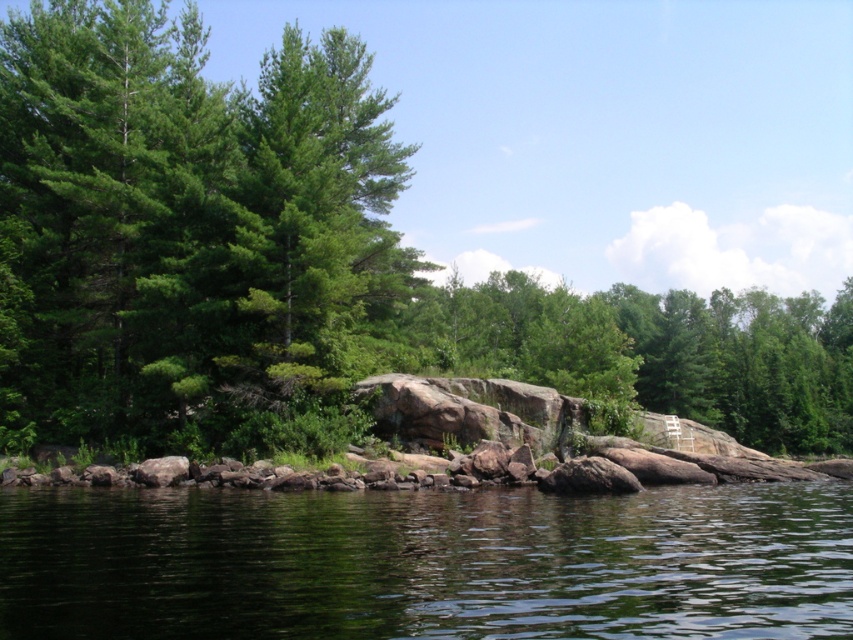
Does green matte tree at left appear on the left side of green matte tree at center?

Correct, you'll find green matte tree at left to the left of green matte tree at center.

Is point (134, 342) farther from viewer compared to point (619, 330)?

That is False.

Does point (117, 269) come farther from viewer compared to point (471, 344)?

No.

Locate an element on the screen. This screenshot has height=640, width=853. green matte tree at left is located at coordinates (189, 234).

Can you confirm if green matte tree at left is thinner than transparent water at lower center?

Incorrect, green matte tree at left's width is not less than transparent water at lower center's.

Between green matte tree at left and transparent water at lower center, which one appears on the right side from the viewer's perspective?

transparent water at lower center

The width and height of the screenshot is (853, 640). What do you see at coordinates (189, 234) in the screenshot?
I see `green matte tree at left` at bounding box center [189, 234].

Where is `green matte tree at left`? green matte tree at left is located at coordinates (189, 234).

Does transparent water at lower center have a greater width compared to green matte tree at center?

No.

Who is taller, transparent water at lower center or green matte tree at center?

green matte tree at center is taller.

The image size is (853, 640). Identify the location of transparent water at lower center. (427, 563).